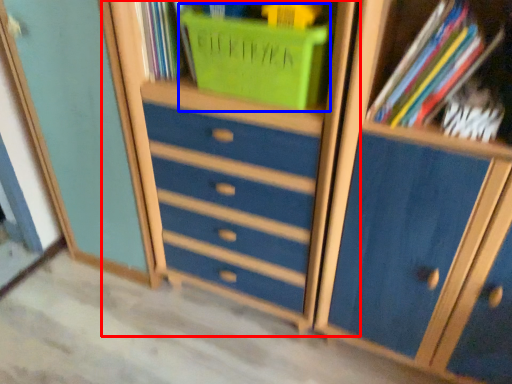
Question: Among these objects, which one is nearest to the camera, dresser (highlighted by a red box) or basket (highlighted by a blue box)?

Choices:
 (A) dresser
 (B) basket

Answer: (A)